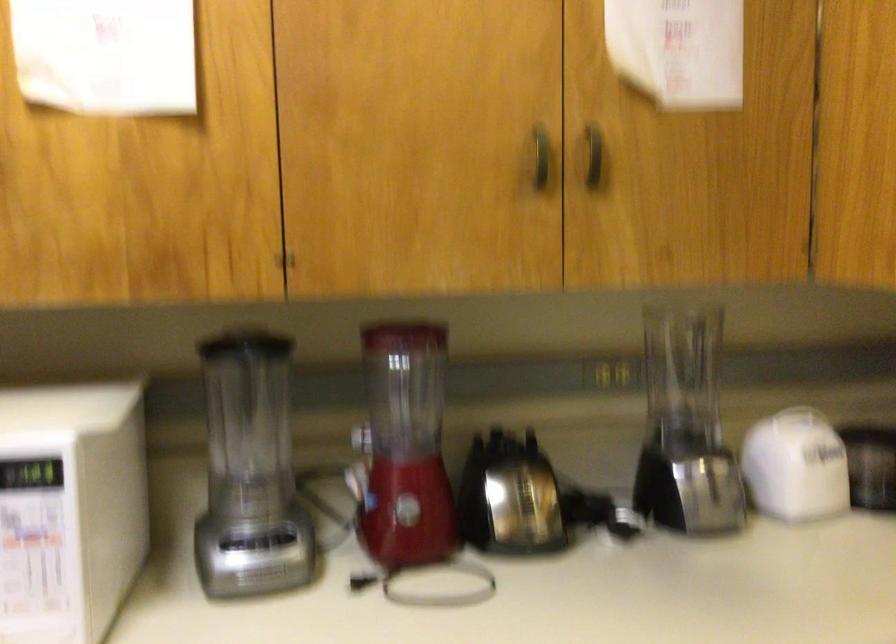
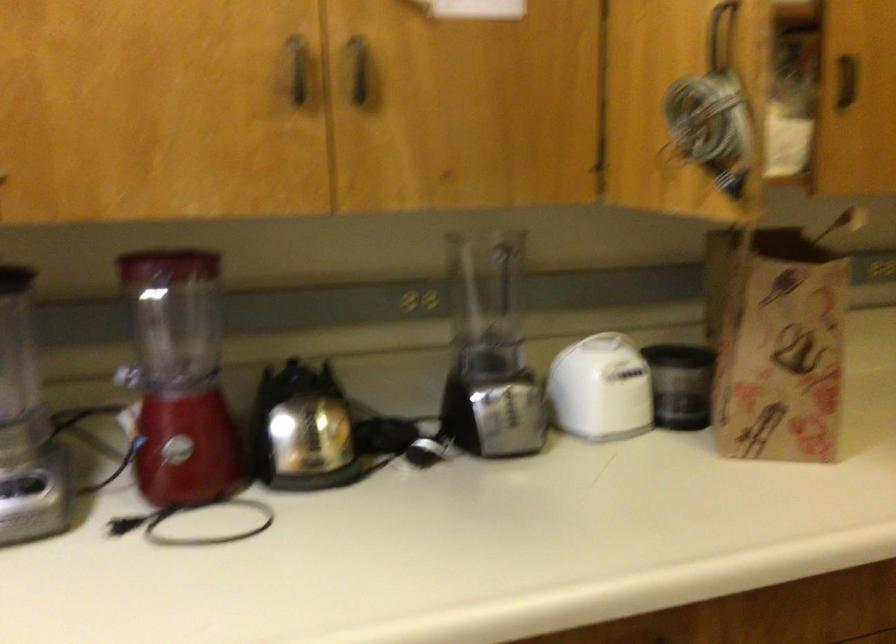
Question: I am providing you with two images of the same scene from different viewpoints. Which of the following objects are not visible in image2?

Choices:
 (A) red blender pitcher
 (B) blender pitcher
 (C) white kitchen appliance
 (D) none of these

Answer: (D)